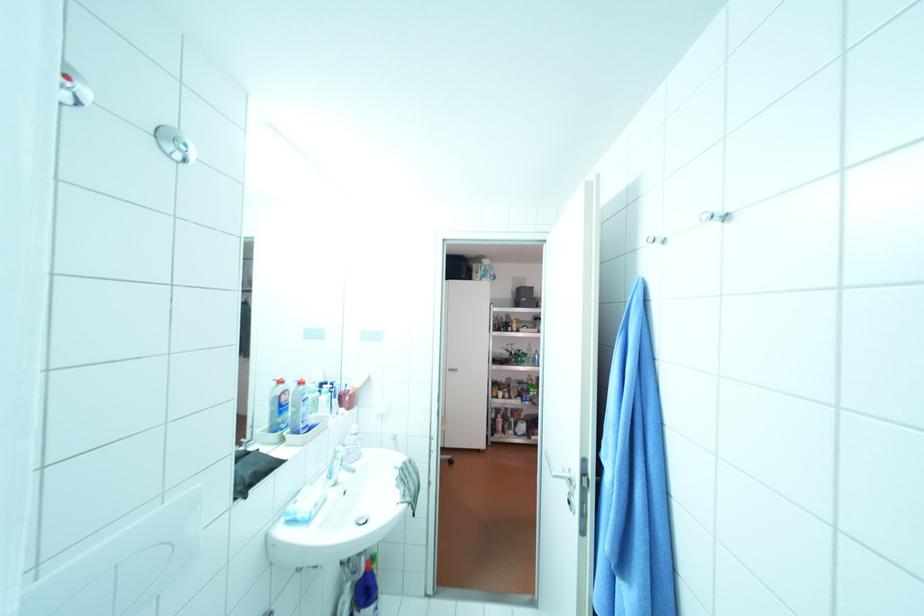
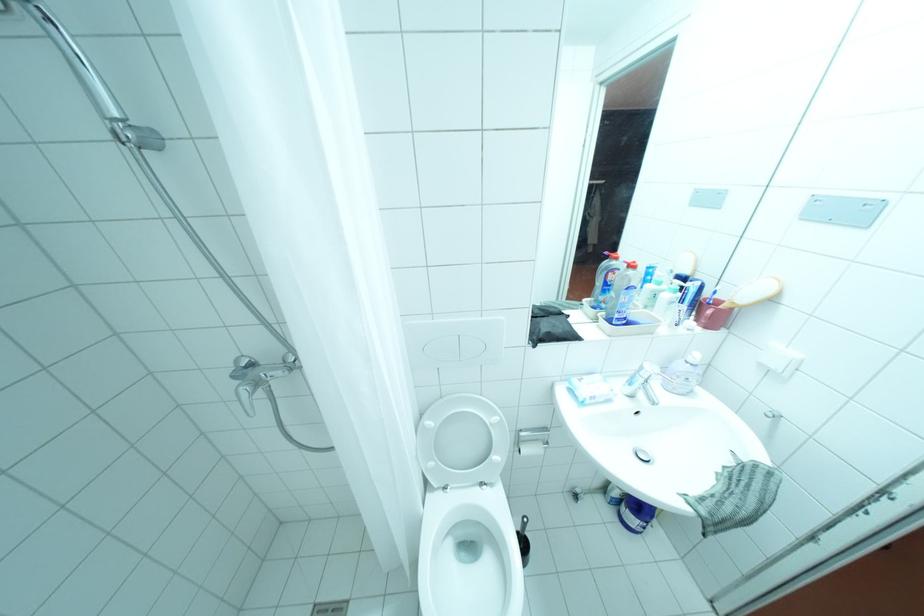
Where in the second image is the point corresponding to [292,424] from the first image?

(612, 305)